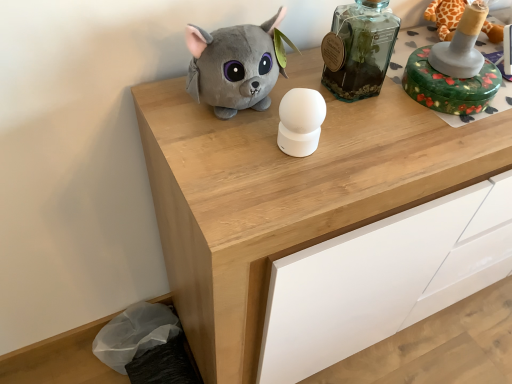
Identify the location of vacant space behind green floral-patterned box at upper right, the 1th toy when ordered from right to left. The image size is (512, 384). (432, 42).